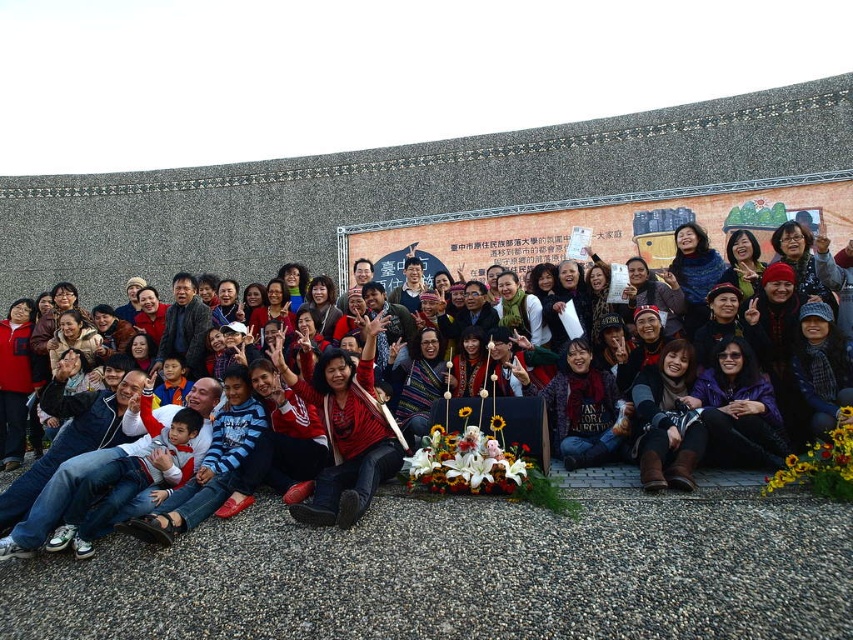
Question: Which object appears closest to the camera in this image?

Choices:
 (A) white silk flowers at center
 (B) yellow matte flowers at lower right

Answer: (B)

Question: Which object appears closest to the camera in this image?

Choices:
 (A) white silk flowers at center
 (B) red sweater at center

Answer: (B)

Question: Considering the relative positions of white silk flowers at center and yellow matte flowers at lower right in the image provided, where is white silk flowers at center located with respect to yellow matte flowers at lower right?

Choices:
 (A) right
 (B) left

Answer: (B)

Question: Which of the following is the farthest from the observer?

Choices:
 (A) white silk flowers at center
 (B) red sweater at center
 (C) yellow matte flowers at lower right

Answer: (A)

Question: Is white silk flowers at center bigger than red sweater at center?

Choices:
 (A) yes
 (B) no

Answer: (B)

Question: Is white silk flowers at center positioned before red sweater at center?

Choices:
 (A) no
 (B) yes

Answer: (A)